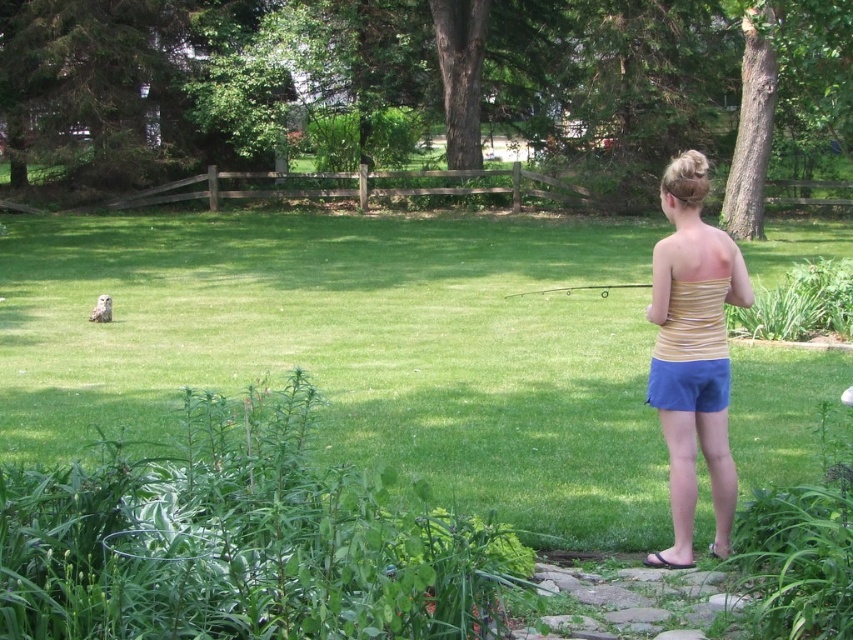
Who is positioned more to the right, green grass at center or yellow striped tank top at center?

From the viewer's perspective, yellow striped tank top at center appears more on the right side.

Identify the location of green grass at center. Image resolution: width=853 pixels, height=640 pixels. (358, 348).